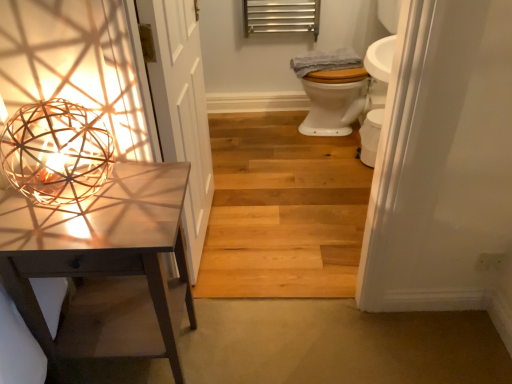
This screenshot has width=512, height=384. In order to click on free point above natural wood floor at center (from a real-world perspective) in this screenshot , I will do `click(278, 184)`.